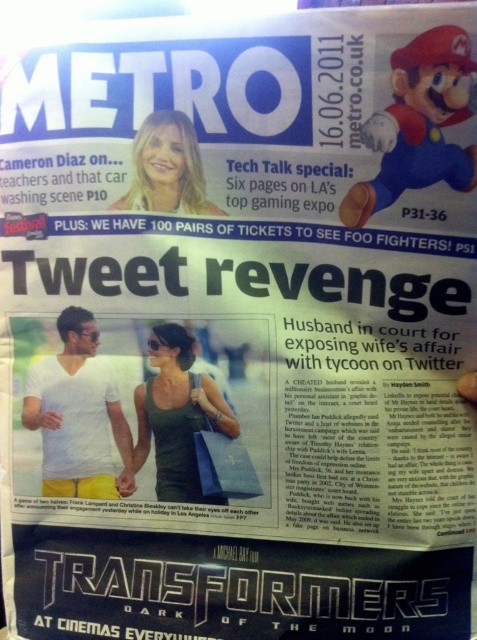
Question: Which of the following is the closest to the observer?

Choices:
 (A) (83, 452)
 (B) (184, 138)
 (C) (136, 461)

Answer: (B)

Question: Which of the following is the closest to the observer?

Choices:
 (A) matte white face at upper center
 (B) white matte t-shirt at center
 (C) green matte tank top at center

Answer: (A)

Question: Which point is closer to the camera?

Choices:
 (A) (182, 356)
 (B) (165, 202)

Answer: (B)

Question: Is white matte t-shirt at center behind green matte tank top at center?

Choices:
 (A) yes
 (B) no

Answer: (A)

Question: Considering the relative positions of green matte tank top at center and matte white face at upper center in the image provided, where is green matte tank top at center located with respect to matte white face at upper center?

Choices:
 (A) below
 (B) above

Answer: (A)

Question: Can you confirm if white matte t-shirt at center is positioned to the right of green matte tank top at center?

Choices:
 (A) no
 (B) yes

Answer: (A)